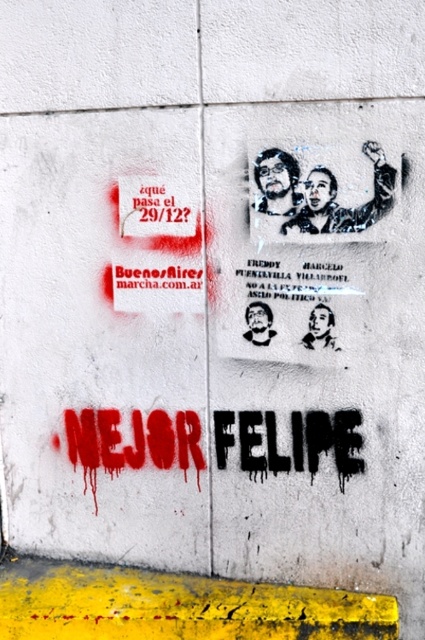
You are a journalist examining the graffiti wall. You notice the dark hair and beard at upper center and the black stencil text at upper center. Which one appears closer to you?

The black stencil text at upper center appears closer because the dark hair and beard at upper center is behind it.

Consider the image. You are a tourist in Buenos Aires and see this wall. You want to take a photo of the dark hair and beard at upper center and the black stencil text at upper center. Where should you position yourself relative to the wall to capture both in the frame?

Position yourself to the left of the wall so that the dark hair and beard at upper center and the black stencil text at upper center are both visible in your frame. Since the black stencil text at upper center is to the right of the dark hair and beard at upper center, being on the left side allows you to capture both elements within the camera view.